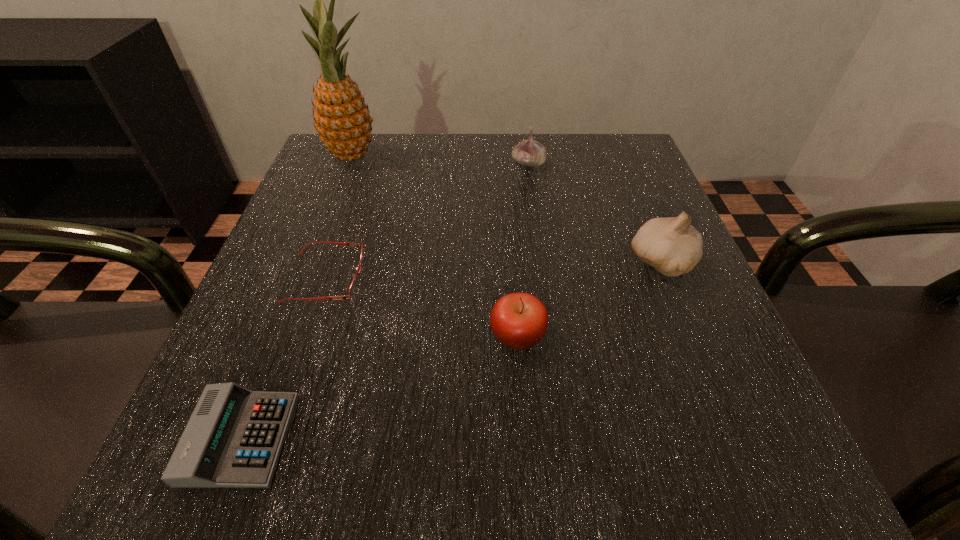
Find the location of a particular element. The height and width of the screenshot is (540, 960). the tallest object is located at coordinates (342, 119).

The image size is (960, 540). Identify the location of the rightmost object. (672, 246).

Locate an element on the screen. Image resolution: width=960 pixels, height=540 pixels. the second tallest object is located at coordinates (672, 246).

The height and width of the screenshot is (540, 960). In order to click on the shorter garlic in this screenshot , I will do `click(529, 152)`.

What are the coordinates of `the left garlic` in the screenshot? It's located at (529, 152).

The width and height of the screenshot is (960, 540). I want to click on the second nearest object, so click(x=519, y=321).

At what (x,y) coordinates should I click in order to perform the action: click on spectacles. Please return your answer as a coordinate pair (x, y). This screenshot has width=960, height=540. Looking at the image, I should click on (352, 290).

You are a GUI agent. You are given a task and a screenshot of the screen. Output one action in this format:
    pyautogui.click(x=<x>, y=<y>)
    Task: Click on the nearest object
    Image resolution: width=960 pixels, height=540 pixels.
    Given the screenshot: What is the action you would take?
    pyautogui.click(x=233, y=439)

Identify the location of vacant space positioned 0.140m on the front of the tallest object. (332, 211).

In order to click on vacant area situated on the left of the taller garlic in this screenshot , I will do `click(444, 262)`.